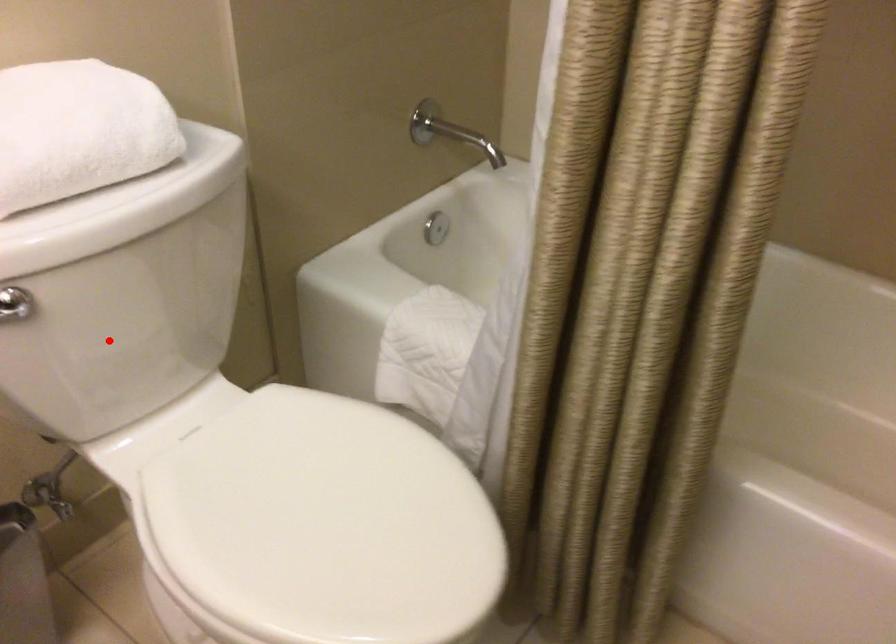
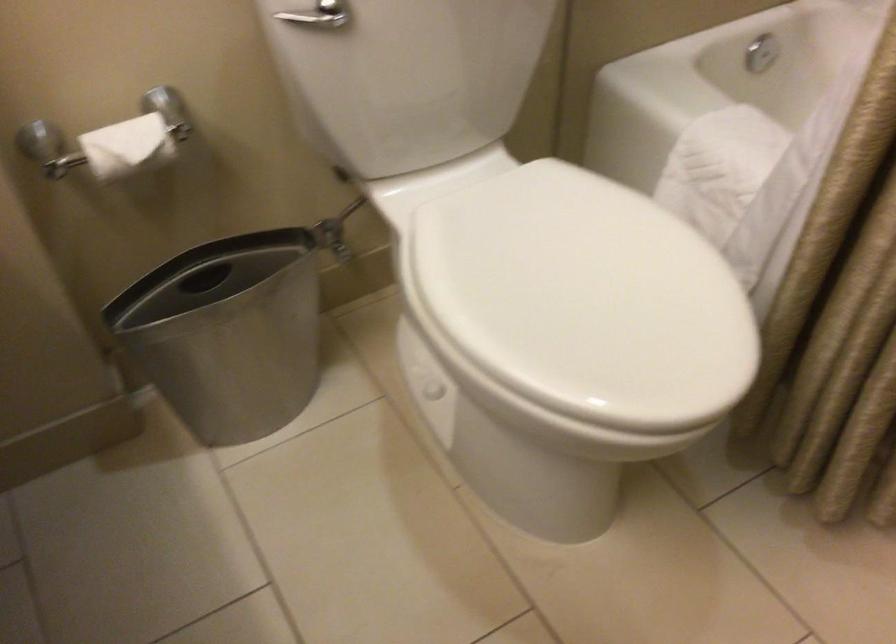
Where in the second image is the point corresponding to the highlighted location from the first image?

(407, 77)